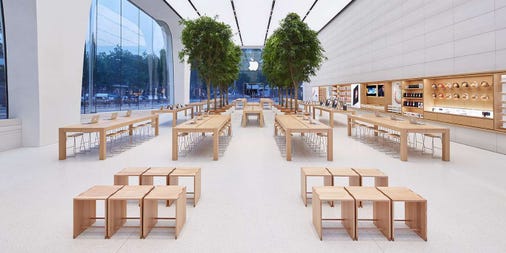
The width and height of the screenshot is (506, 253). What are the coordinates of `computer` in the screenshot? It's located at (484, 83).